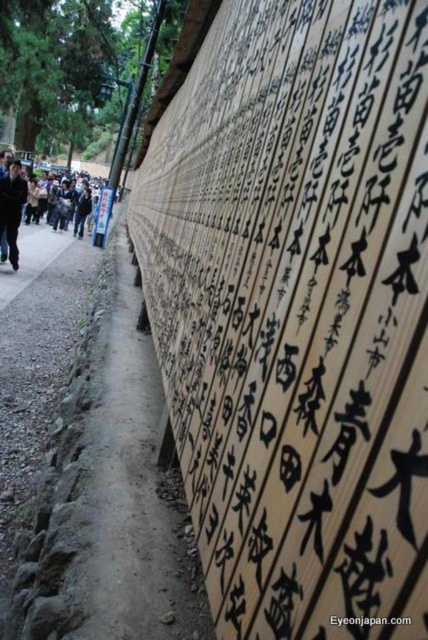
Question: Does dark brown leather jacket at left appear over dark blue jacket at left?

Choices:
 (A) yes
 (B) no

Answer: (A)

Question: Which of the following is the farthest from the observer?

Choices:
 (A) dark brown leather jacket at left
 (B) dark blue jacket at left

Answer: (A)

Question: Can you confirm if dirt path at center is bigger than dark brown leather jacket at left?

Choices:
 (A) no
 (B) yes

Answer: (A)

Question: Which of the following is the farthest from the observer?

Choices:
 (A) (14, 227)
 (B) (80, 596)
 (C) (6, 193)

Answer: (A)

Question: Is dark brown leather jacket at left above dark blue jacket at left?

Choices:
 (A) no
 (B) yes

Answer: (B)

Question: Which object is farther from the camera taking this photo?

Choices:
 (A) dirt path at center
 (B) dark blue jacket at left

Answer: (B)